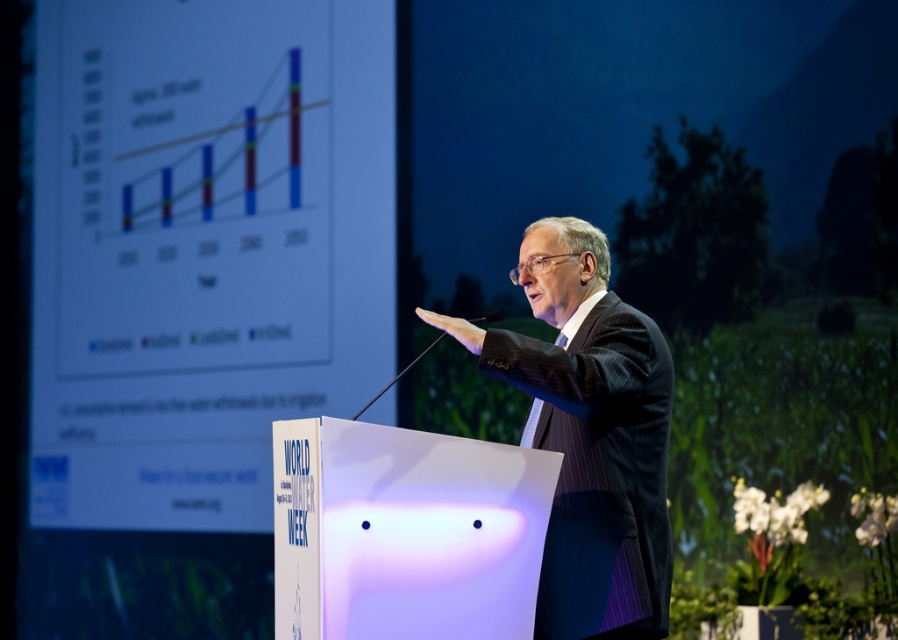
You are an event organizer who needs to ensure that the dark suit at center is visible to all attendees. Given that the matte white screen at upper left is currently displaying important data, could the screen potentially block the view of the speaker?

The matte white screen at upper left is larger in size than the dark suit at center. Since the screen is bigger, it might block the view of the speaker depending on its placement, but the description does not specify their exact positions. However, the screen is at the upper left, so it could partially obstruct the speaker if positioned between the audience and the dark suit at center.

You are an attendee at this presentation. The speaker is pointing towards a specific location on the screen. Can you tell me what object is located at the coordinates point (201, 248) on the screen?

The point (201, 248) corresponds to the matte white screen at upper left.